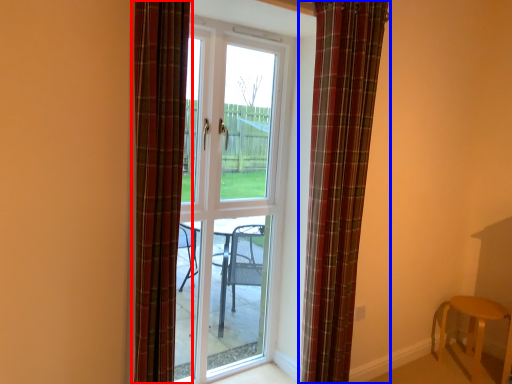
Question: Among these objects, which one is nearest to the camera, curtain (highlighted by a red box) or curtain (highlighted by a blue box)?

Choices:
 (A) curtain
 (B) curtain

Answer: (A)